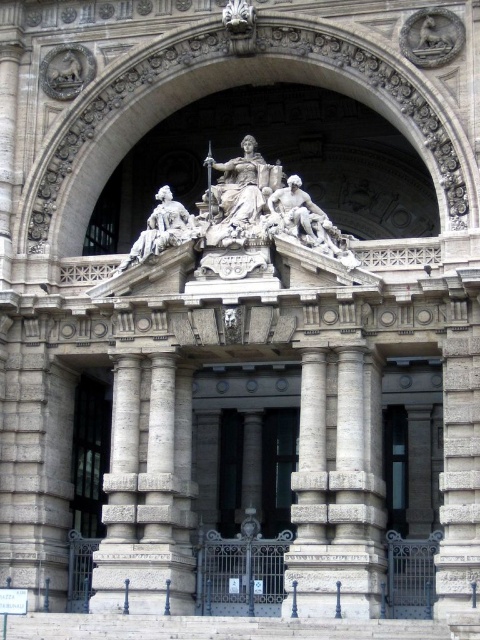
You are a visitor approaching the grand entrance of a classical building. You notice the stone archway at center and the glass paneled door at center. Which object is positioned higher in the image?

The stone archway at center is located above the glass paneled door at center, so it is positioned higher in the image.